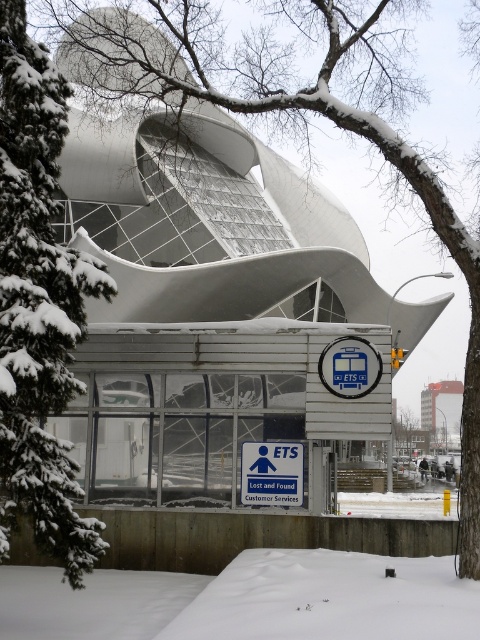
You are standing at the bus stop shelter with the ETS sign and want to reach a specific point marked at coordinates point (324, 368). If your maximum comfortable walking distance is 20 meters, can you comfortably walk to that point from your current position?

The distance of point (324, 368) from viewer is 18.53 meters, so yes, you can comfortably walk to that point since it is within your 20 meters limit.